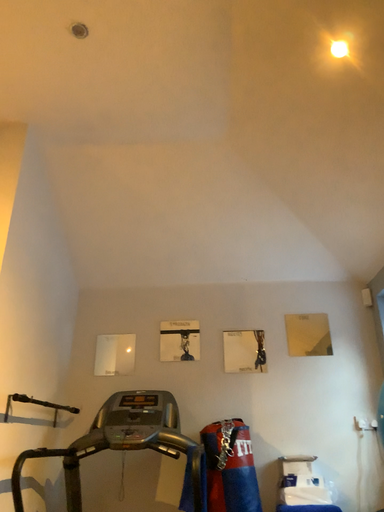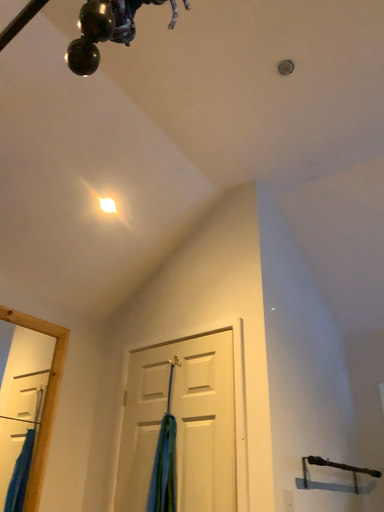
Question: Which way did the camera rotate in the video?

Choices:
 (A) rotated right
 (B) rotated left

Answer: (B)